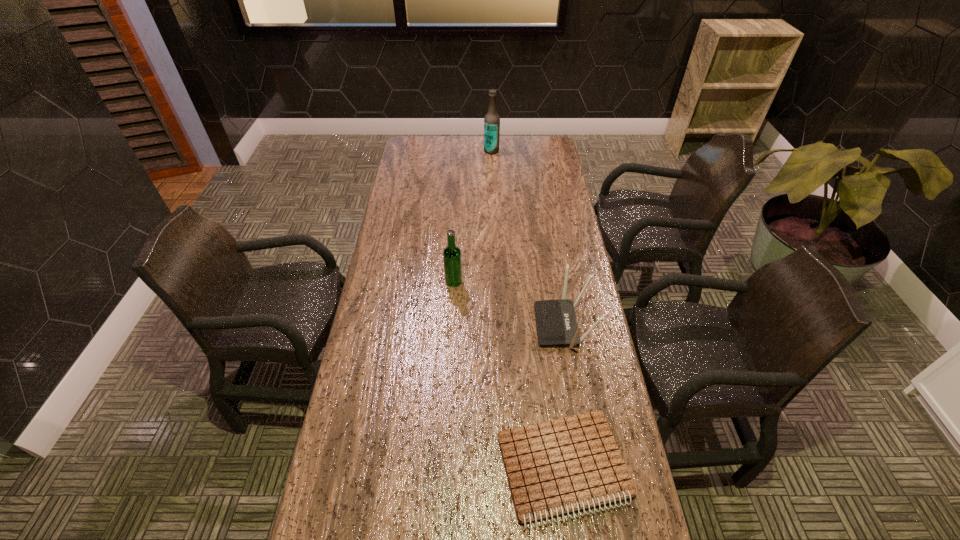
In the image, there is a desktop. Identify the location of free space at the right edge. The width and height of the screenshot is (960, 540). (551, 177).

Identify the location of free spot at the far left corner of the desktop. Image resolution: width=960 pixels, height=540 pixels. (413, 142).

At what (x,y) coordinates should I click in order to perform the action: click on vacant region at the far right corner of the desktop. Please return your answer as a coordinate pair (x, y). This screenshot has height=540, width=960. Looking at the image, I should click on (531, 147).

The height and width of the screenshot is (540, 960). Find the location of `vacant area that lies between the notebook and the second farthest object`. vacant area that lies between the notebook and the second farthest object is located at coordinates (509, 375).

Identify the location of empty space that is in between the shortest object and the router. The width and height of the screenshot is (960, 540). (564, 397).

The height and width of the screenshot is (540, 960). What are the coordinates of `vacant space that's between the right beer bottle and the nearest object` in the screenshot? It's located at (527, 309).

Locate an element on the screen. vacant space in between the nearest object and the farther beer bottle is located at coordinates (527, 309).

Locate an element on the screen. Image resolution: width=960 pixels, height=540 pixels. vacant area between the second farthest object and the third farthest object is located at coordinates (509, 303).

This screenshot has width=960, height=540. In order to click on free spot between the tallest object and the leftmost object in this screenshot , I will do `click(472, 216)`.

Locate an element on the screen. The image size is (960, 540). free space between the third farthest object and the tallest object is located at coordinates (527, 238).